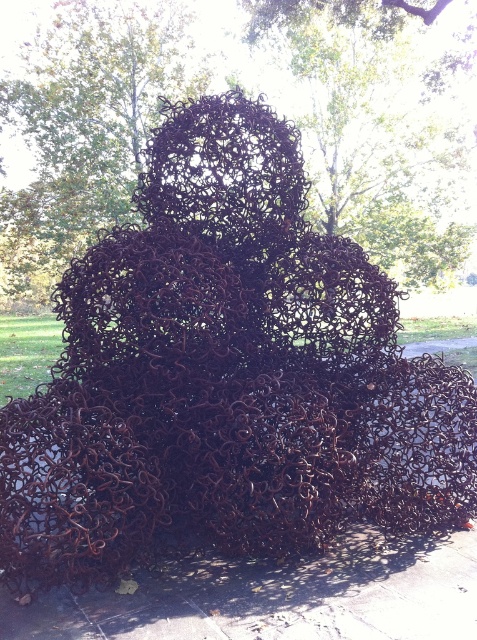
This screenshot has height=640, width=477. Describe the element at coordinates (379, 132) in the screenshot. I see `rusty wire sculpture at center` at that location.

Is rusty wire sculpture at center to the left of gray concrete pavement at lower center from the viewer's perspective?

Correct, you'll find rusty wire sculpture at center to the left of gray concrete pavement at lower center.

Does point (63, 211) come in front of point (427, 582)?

No, it is not.

Find the location of `rusty wire sculpture at center`. rusty wire sculpture at center is located at coordinates (379, 132).